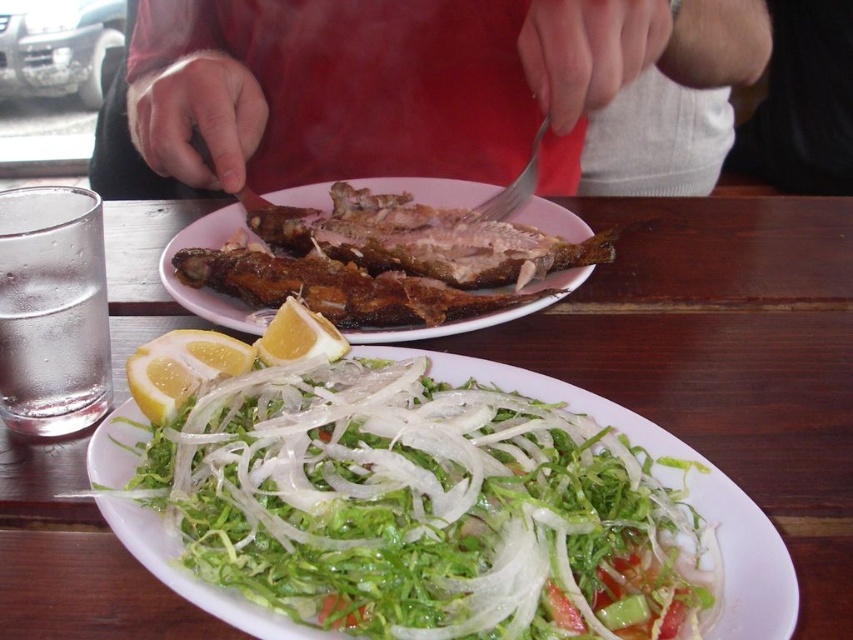
Which is more to the right, smooth red shirt at center or yellow matte lemon at lower left?

From the viewer's perspective, yellow matte lemon at lower left appears more on the right side.

Which is above, smooth red shirt at center or yellow matte lemon at lower left?

smooth red shirt at center

This screenshot has width=853, height=640. What do you see at coordinates (428, 92) in the screenshot?
I see `smooth red shirt at center` at bounding box center [428, 92].

Locate an element on the screen. This screenshot has height=640, width=853. smooth red shirt at center is located at coordinates (428, 92).

Between brown crispy fish at center and silver metallic fork at upper center, which one appears on the right side from the viewer's perspective?

silver metallic fork at upper center

Find the location of a particular element. The height and width of the screenshot is (640, 853). brown crispy fish at center is located at coordinates (207, 289).

From the picture: Which is more to the left, translucent white shredded vegetable at lower center or yellow matte lemon at lower left?

yellow matte lemon at lower left

Can you confirm if translucent white shredded vegetable at lower center is wider than yellow matte lemon at lower left?

Yes, translucent white shredded vegetable at lower center is wider than yellow matte lemon at lower left.

Is point (161, 545) behind point (164, 385)?

No.

The image size is (853, 640). I want to click on translucent white shredded vegetable at lower center, so click(415, 508).